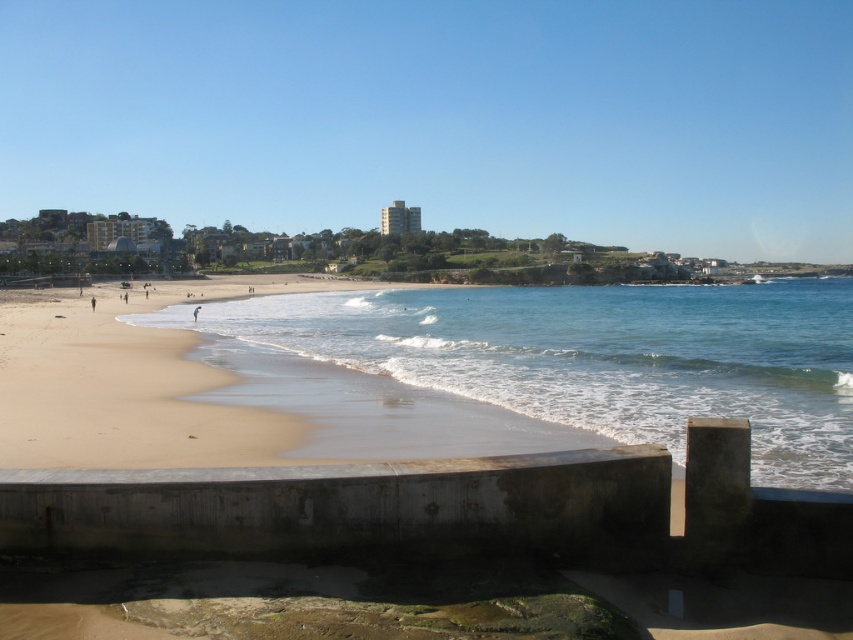
You are standing on the concrete seawall and want to reach the light brown sand at lower left. Which direction should you move to get there?

The light brown sand at lower left is located at point (119, 394), so you should move towards the lower left direction from your current position on the concrete seawall.

You are standing at the point marked as point (22, 426) on the beach. If you walk directly towards the ocean, how far will you have to go to reach the water?

You are currently at point (22, 426), and the distance between you and the ocean is 43.22 feet, so you will have to walk 43.22 feet to reach the water.

In the scene shown: Based on the scene description, can you determine if the clear blue water at beach left is above or below the skinny person at beach center?

The clear blue water at beach left is positioned over the skinny person at beach center, meaning it is above them.